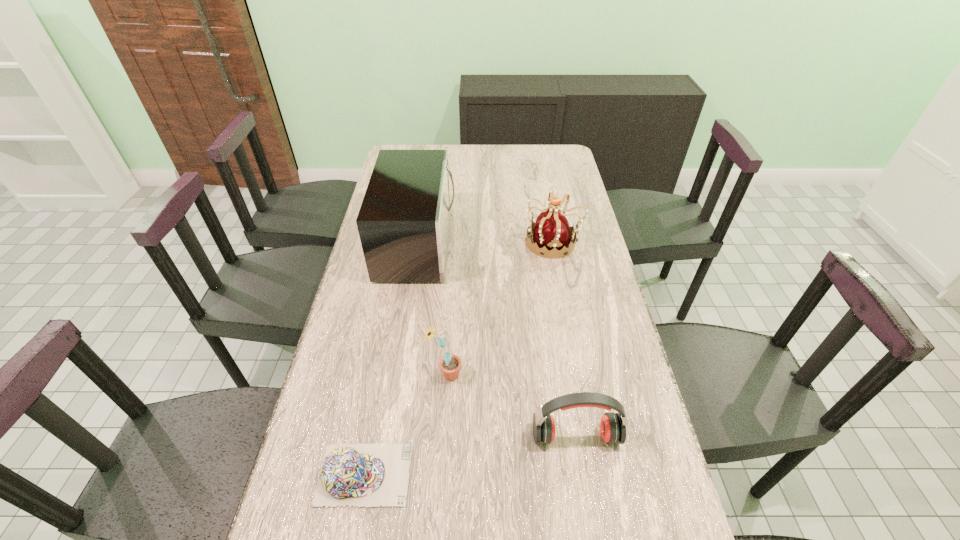
Identify the location of microwave oven. (404, 220).

Locate an element on the screen. tiara is located at coordinates (552, 234).

Identify the location of sunflower. This screenshot has height=540, width=960. (450, 364).

The width and height of the screenshot is (960, 540). What are the coordinates of `earphone` in the screenshot? It's located at (613, 425).

The height and width of the screenshot is (540, 960). I want to click on the shortest object, so click(x=370, y=475).

What are the coordinates of `free space located with the door open on the microwave oven` in the screenshot? It's located at (477, 243).

Identify the location of vacant space located 0.190m on the front-facing side of the tiara. (469, 242).

The height and width of the screenshot is (540, 960). I want to click on free space located on the front-facing side of the tiara, so click(x=442, y=242).

Locate an element on the screen. This screenshot has width=960, height=540. vacant area situated 0.240m on the front-facing side of the tiara is located at coordinates (456, 242).

I want to click on vacant space located on the flower of the third nearest object, so click(481, 375).